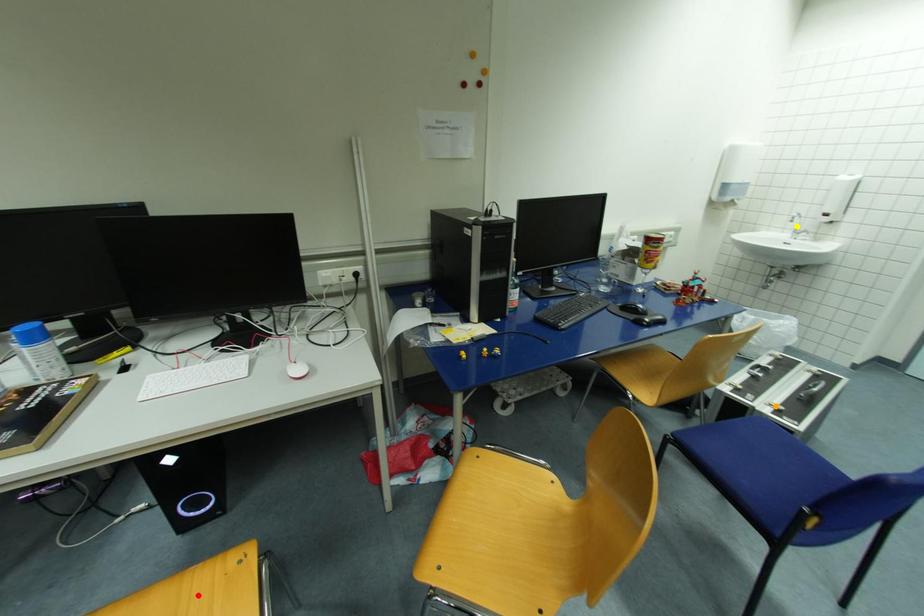
Order these from farthest to nearest:
yellow point, orange point, red point

yellow point, orange point, red point